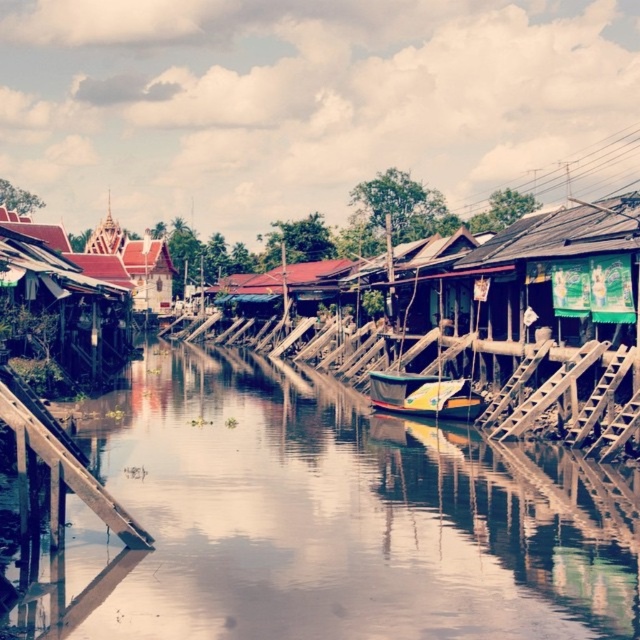
You are standing on the bank of the waterway and see the brown wooden river at center and the wooden boat at center. Which object is closer to the water surface?

The wooden boat at center is closer to the water surface because the brown wooden river at center is located below it.

You are navigating a wooden boat at center through a brown wooden river at center. According to the scene, which object is closer to you as you look ahead?

The brown wooden river at center is closer to you since it is positioned in front of the wooden boat at center.